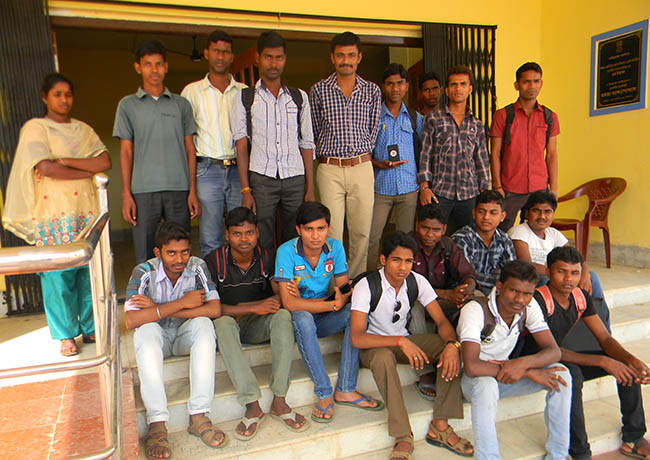
The image size is (650, 460). In order to click on wall in this screenshot , I will do `click(604, 144)`.